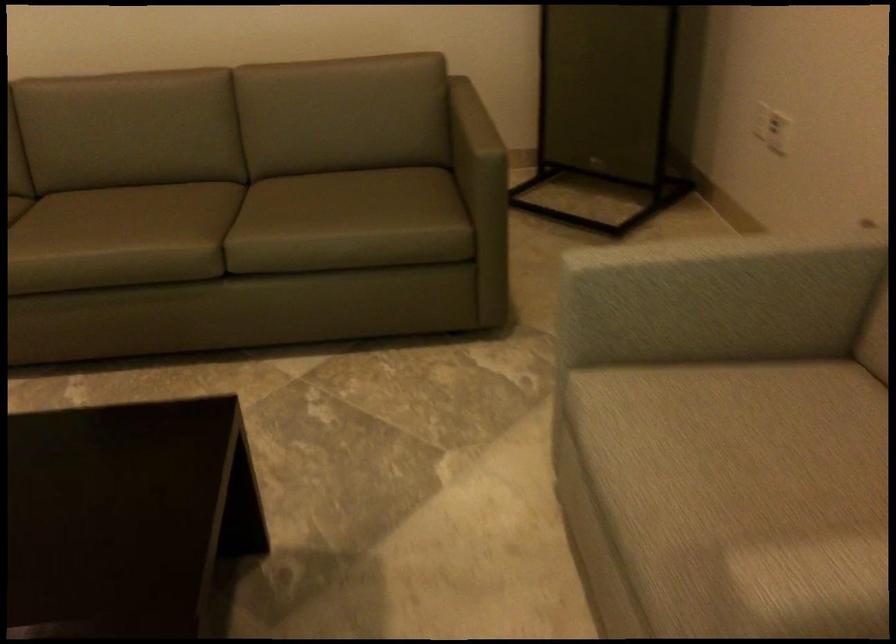
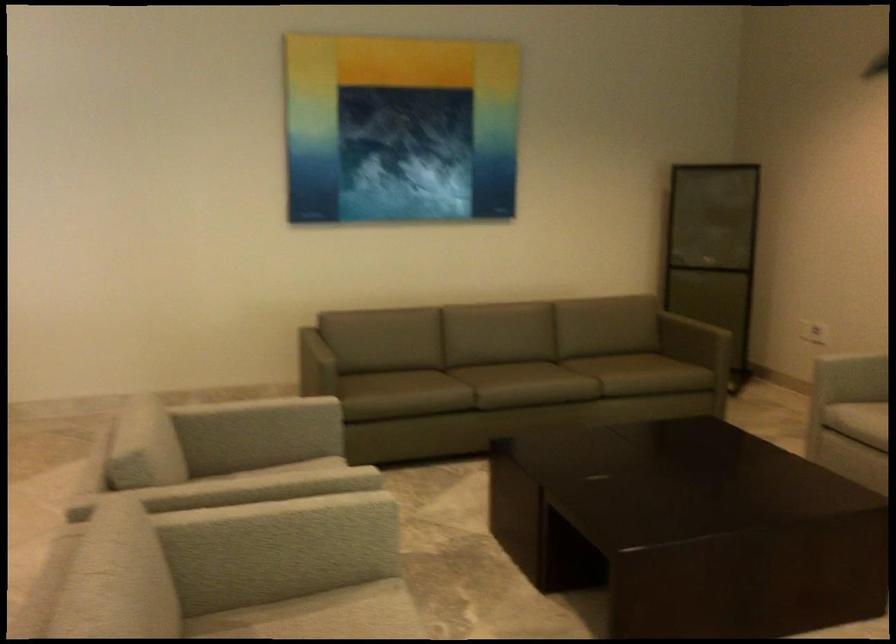
Find the pixel in the second image that matches point 676,442 in the first image.

(857, 420)